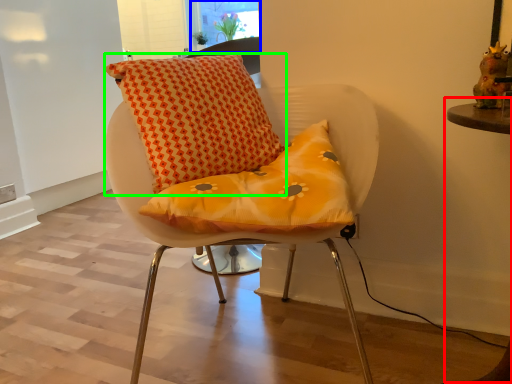
Question: Which object is the closest to the table (highlighted by a red box)? Choose among these: window screen (highlighted by a blue box) or pillow (highlighted by a green box).

Choices:
 (A) window screen
 (B) pillow

Answer: (B)